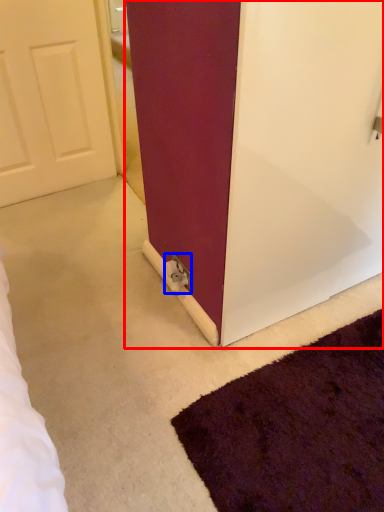
Question: Which point is further to the camera, door (highlighted by a red box) or electric outlet (highlighted by a blue box)?

Choices:
 (A) door
 (B) electric outlet

Answer: (B)